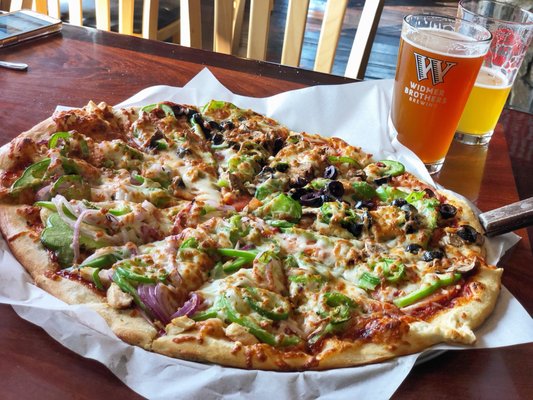
You are a GUI agent. You are given a task and a screenshot of the screen. Output one action in this format:
    pyautogui.click(x=<x>, y=<y>)
    Task: Click on the fully filled glass
    Image resolution: width=533 pixels, height=400 pixels.
    Given the screenshot: What is the action you would take?
    pyautogui.click(x=437, y=71)